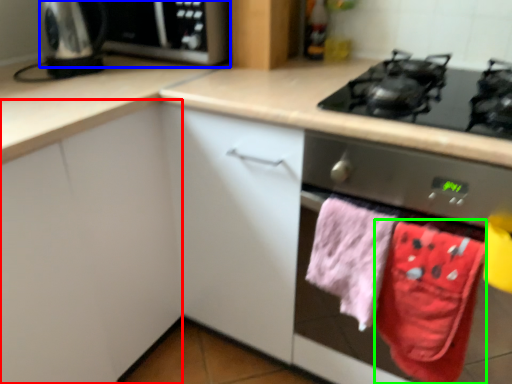
Question: Which object is positioned farthest from cabinetry (highlighted by a red box)? Select from microwave (highlighted by a blue box) and beach towel (highlighted by a green box).

Choices:
 (A) microwave
 (B) beach towel

Answer: (B)